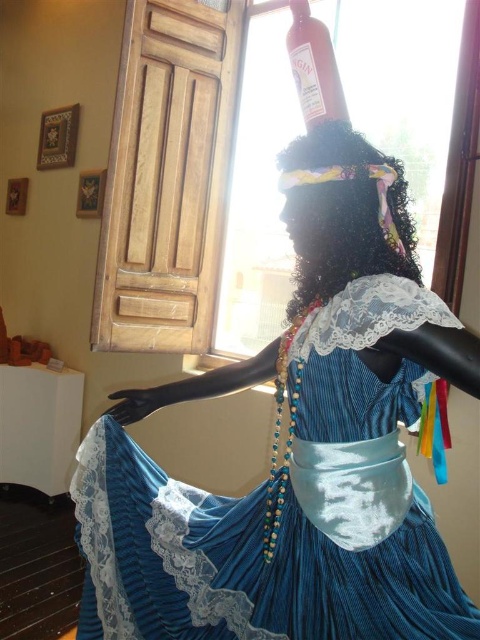
Who is positioned more to the left, blue velvet dress at center or matte glass bottle at upper center?

blue velvet dress at center is more to the left.

Can you confirm if blue velvet dress at center is positioned above matte glass bottle at upper center?

Actually, blue velvet dress at center is below matte glass bottle at upper center.

Where is `blue velvet dress at center`? The height and width of the screenshot is (640, 480). blue velvet dress at center is located at coordinates (297, 448).

Locate an element on the screen. The width and height of the screenshot is (480, 640). blue velvet dress at center is located at coordinates (297, 448).